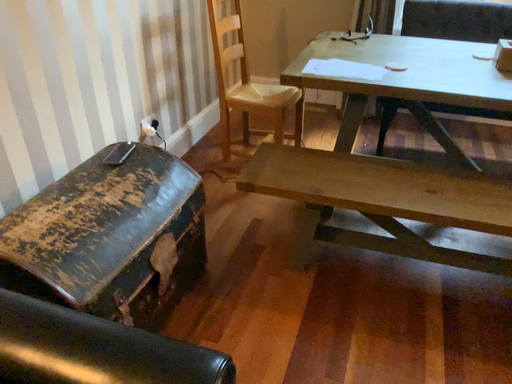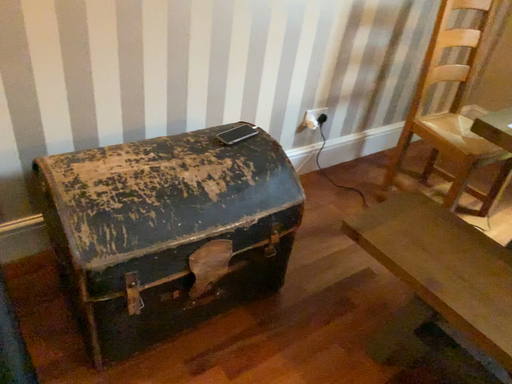
Question: Which way did the camera rotate in the video?

Choices:
 (A) rotated left
 (B) rotated right

Answer: (A)